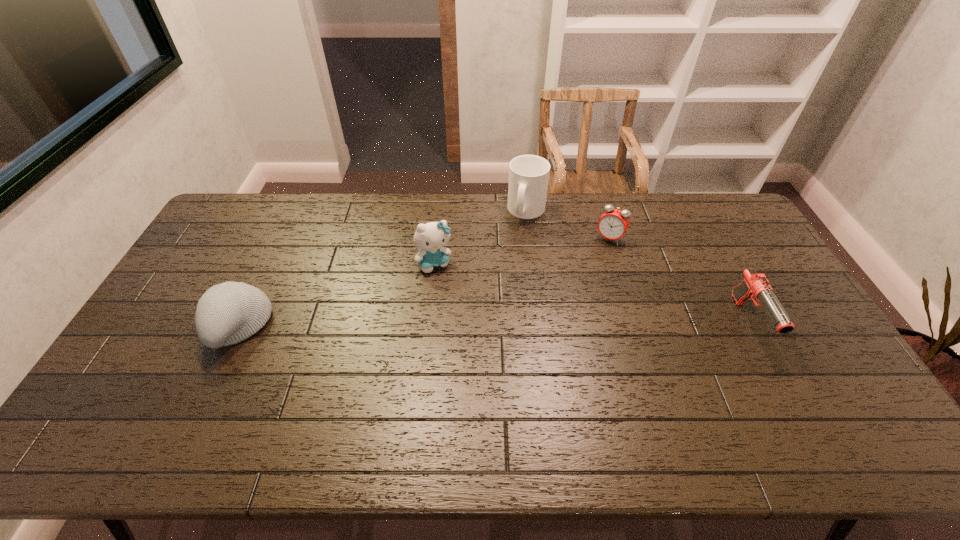
This screenshot has width=960, height=540. In order to click on free space between the mug and the alarm clock in this screenshot , I will do `click(568, 225)`.

Locate an element on the screen. The width and height of the screenshot is (960, 540). vacant point located between the third nearest object and the leftmost object is located at coordinates (337, 294).

Identify the location of vacant area that lies between the fourth object from left to right and the leftmost object. This screenshot has height=540, width=960. (423, 282).

Image resolution: width=960 pixels, height=540 pixels. Find the location of `free space between the mug and the second object from right to left`. free space between the mug and the second object from right to left is located at coordinates (568, 225).

Find the location of a particular element. This screenshot has height=540, width=960. free space between the leftmost object and the kitten is located at coordinates (337, 294).

Locate an element on the screen. vacant point located between the fourth object from right to left and the second object from right to left is located at coordinates (522, 251).

Identify which object is located as the nearest to the third nearest object. Please provide its 2D coordinates. Your answer should be formatted as a tuple, i.e. [(x, y)], where the tuple contains the x and y coordinates of a point satisfying the conditions above.

[(528, 174)]

Where is `the third closest object to the gun`? The image size is (960, 540). the third closest object to the gun is located at coordinates (430, 238).

What are the coordinates of `vacant space that satisfies the following two spatial constraints: 1. on the back side of the fourth object from left to right; 2. on the right side of the third farthest object` in the screenshot? It's located at (438, 239).